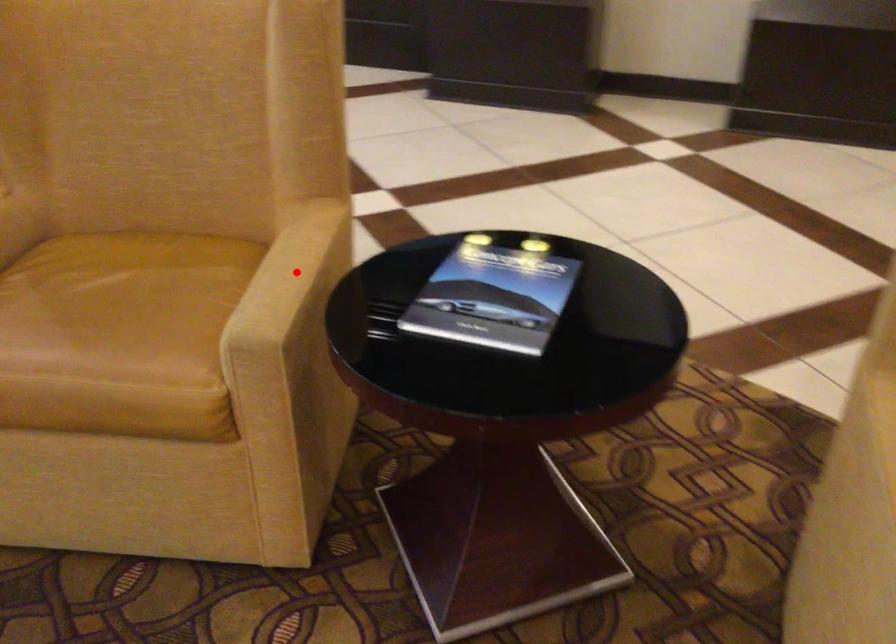
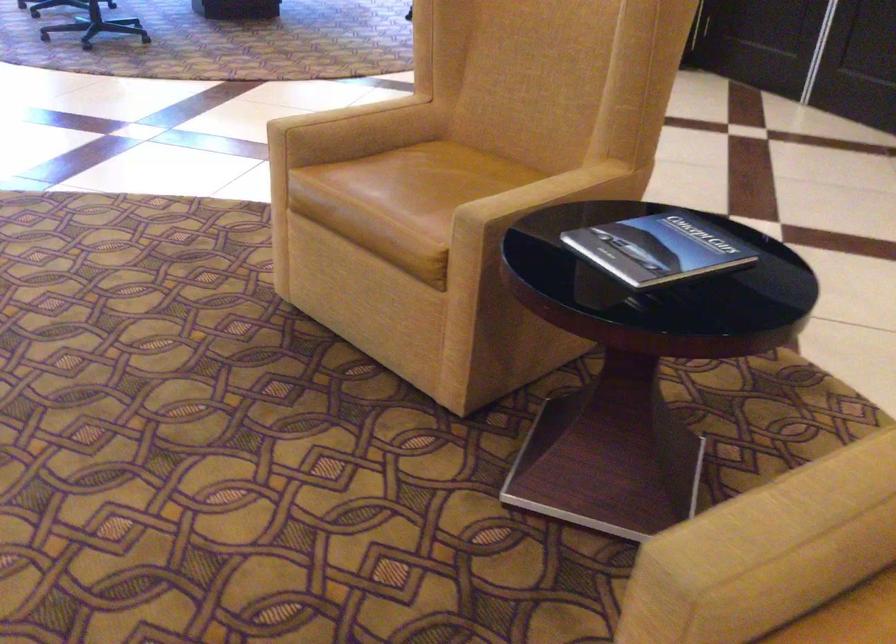
In the second image, find the point that corresponds to the highlighted location in the first image.

(541, 193)